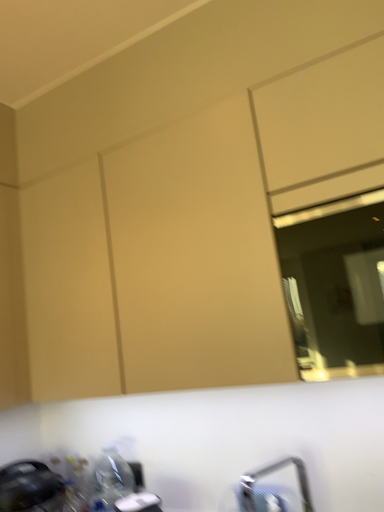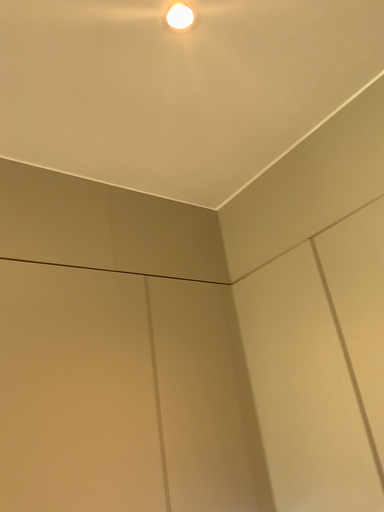
Question: How did the camera likely rotate when shooting the video?

Choices:
 (A) rotated right
 (B) rotated left

Answer: (B)